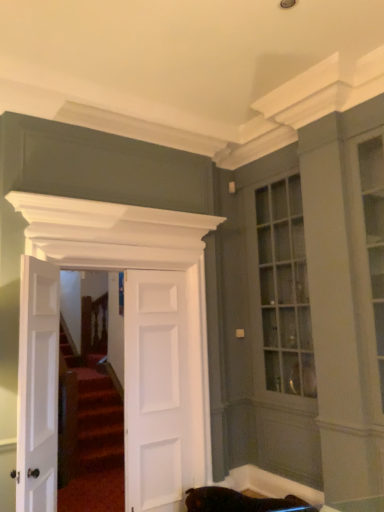
Question: Does white matte door at left, marked as the first door in a left-to-right arrangement, appear on the left side of white matte door at center, the 2th door positioned from the right?

Choices:
 (A) yes
 (B) no

Answer: (A)

Question: From a real-world perspective, is white matte door at left, marked as the first door in a left-to-right arrangement, on white matte door at center, the 2th door positioned from the right?

Choices:
 (A) yes
 (B) no

Answer: (A)

Question: Does white matte door at left, marked as the first door in a left-to-right arrangement, have a greater height compared to white matte door at center, the 2th door positioned from the right?

Choices:
 (A) no
 (B) yes

Answer: (A)

Question: Considering the relative sizes of white matte door at left, the 3th door when ordered from right to left, and white matte door at center, which is counted as the 2th door, starting from the left, in the image provided, is white matte door at left, the 3th door when ordered from right to left, wider than white matte door at center, which is counted as the 2th door, starting from the left,?

Choices:
 (A) yes
 (B) no

Answer: (A)

Question: Is white matte door at left, marked as the first door in a left-to-right arrangement, far away from white matte door at center, which is counted as the 2th door, starting from the left?

Choices:
 (A) no
 (B) yes

Answer: (A)

Question: From their relative heights in the image, would you say white matte door at center, arranged as the first door when viewed from the right, is taller or shorter than white matte door at left, marked as the first door in a left-to-right arrangement?

Choices:
 (A) tall
 (B) short

Answer: (A)

Question: From a real-world perspective, relative to white matte door at left, marked as the first door in a left-to-right arrangement, is white matte door at center, arranged as the first door when viewed from the right, vertically above or below?

Choices:
 (A) above
 (B) below

Answer: (B)

Question: Considering the positions of point tap(182, 306) and point tap(43, 295), is point tap(182, 306) closer or farther from the camera than point tap(43, 295)?

Choices:
 (A) closer
 (B) farther

Answer: (B)

Question: Would you say white matte door at center, the 3th door positioned from the left, is inside or outside white matte door at left, marked as the first door in a left-to-right arrangement?

Choices:
 (A) inside
 (B) outside

Answer: (B)

Question: In the image, is white matte door at center, the 2th door positioned from the right, positioned in front of or behind white matte door at left, the 3th door when ordered from right to left?

Choices:
 (A) behind
 (B) front

Answer: (A)

Question: Considering the positions of white matte door at center, the 2th door positioned from the right, and white matte door at left, the 3th door when ordered from right to left, in the image, is white matte door at center, the 2th door positioned from the right, taller or shorter than white matte door at left, the 3th door when ordered from right to left,?

Choices:
 (A) short
 (B) tall

Answer: (B)

Question: Is white matte door at center, the 2th door positioned from the right, wider or thinner than white matte door at left, the 3th door when ordered from right to left?

Choices:
 (A) thin
 (B) wide

Answer: (A)

Question: From the image's perspective, relative to white matte door at left, the 3th door when ordered from right to left, is white matte door at center, the 2th door positioned from the right, above or below?

Choices:
 (A) below
 (B) above

Answer: (A)

Question: In terms of height, does white matte door at left, the 3th door when ordered from right to left, look taller or shorter compared to white matte door at center, which is counted as the 2th door, starting from the left?

Choices:
 (A) short
 (B) tall

Answer: (A)

Question: Is white matte door at left, marked as the first door in a left-to-right arrangement, to the left or to the right of white matte door at center, which is counted as the 2th door, starting from the left, in the image?

Choices:
 (A) left
 (B) right

Answer: (A)